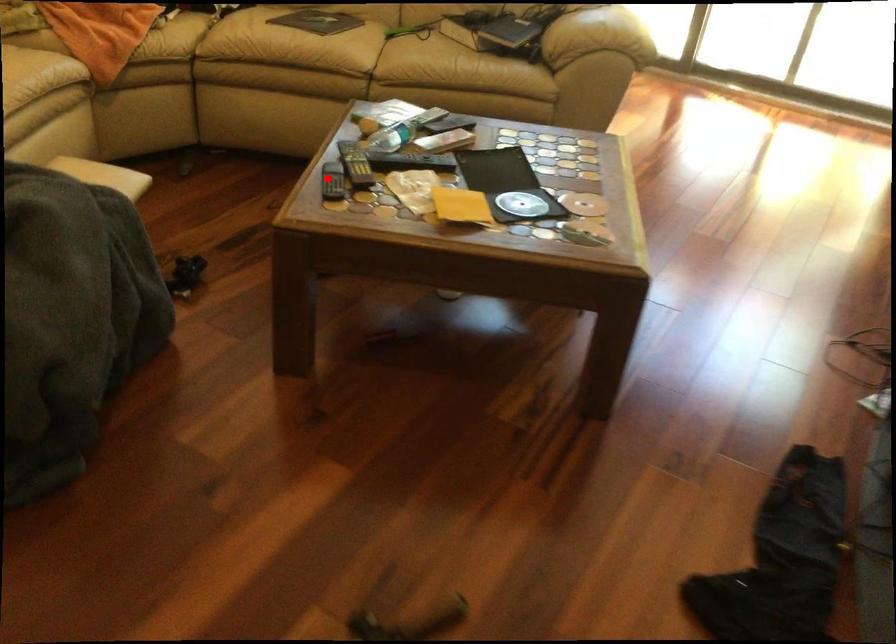
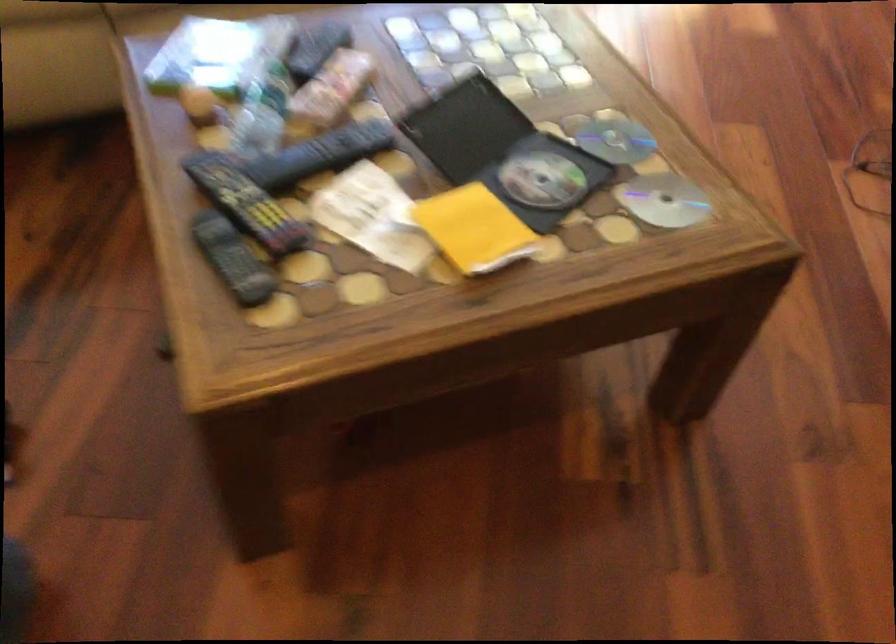
Find the pixel in the second image that matches the highlighted location in the first image.

(233, 259)